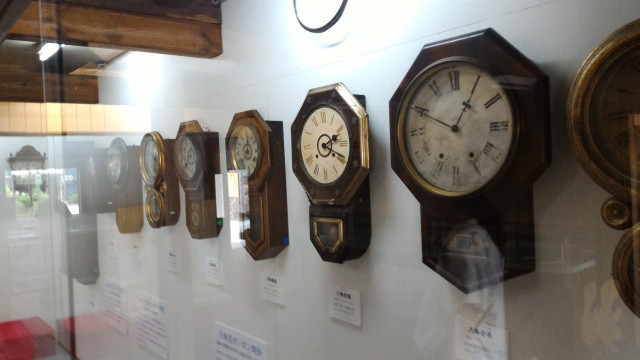
Find the location of a particular element. The height and width of the screenshot is (360, 640). red bench is located at coordinates (35, 338).